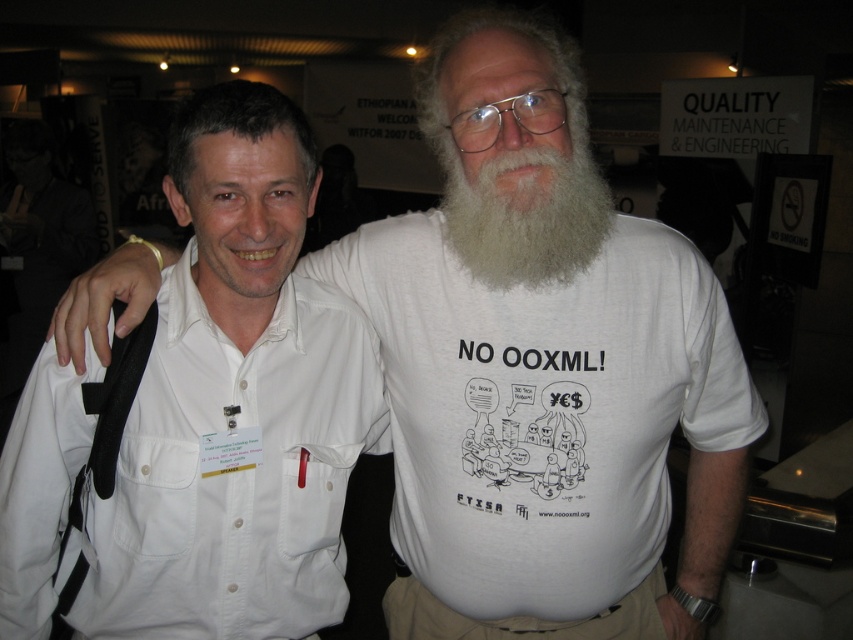
Question: Which point is farther from the camera taking this photo?

Choices:
 (A) (646, 588)
 (B) (245, 461)
 (C) (579, 138)
 (D) (383, 220)

Answer: (A)

Question: Can you confirm if white cotton t-shirt at center is positioned below white fuzzy beard at center?

Choices:
 (A) yes
 (B) no

Answer: (A)

Question: Which point is farther to the camera?

Choices:
 (A) white cotton t-shirt at center
 (B) white fuzzy beard at center
 (C) khaki pants at lower center
 (D) white cotton shirt at left

Answer: (C)

Question: Is the position of white cotton shirt at left more distant than that of khaki pants at lower center?

Choices:
 (A) no
 (B) yes

Answer: (A)

Question: Which object appears closest to the camera in this image?

Choices:
 (A) white cotton t-shirt at center
 (B) white cotton shirt at left
 (C) khaki pants at lower center

Answer: (B)

Question: Can you confirm if white fuzzy beard at center is thinner than khaki pants at lower center?

Choices:
 (A) yes
 (B) no

Answer: (A)